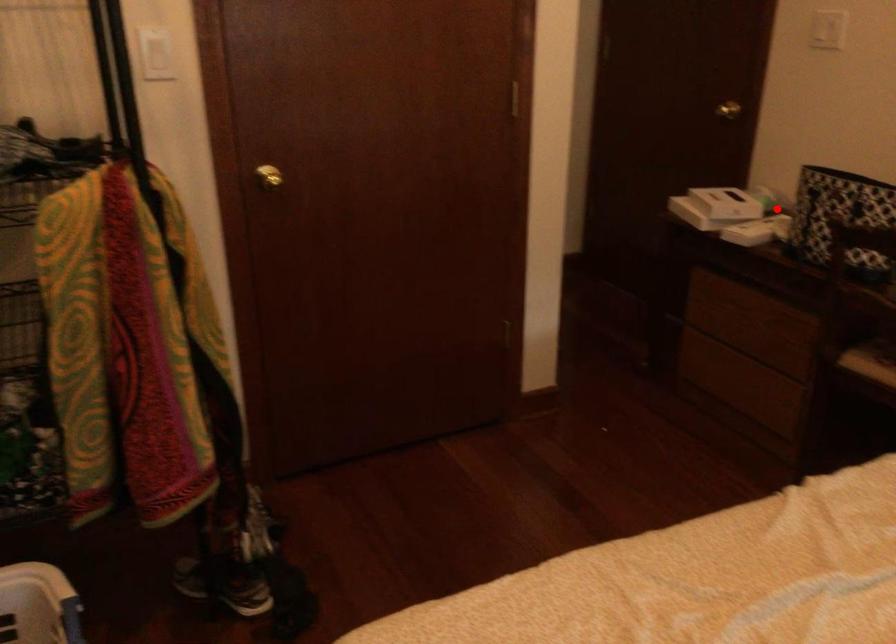
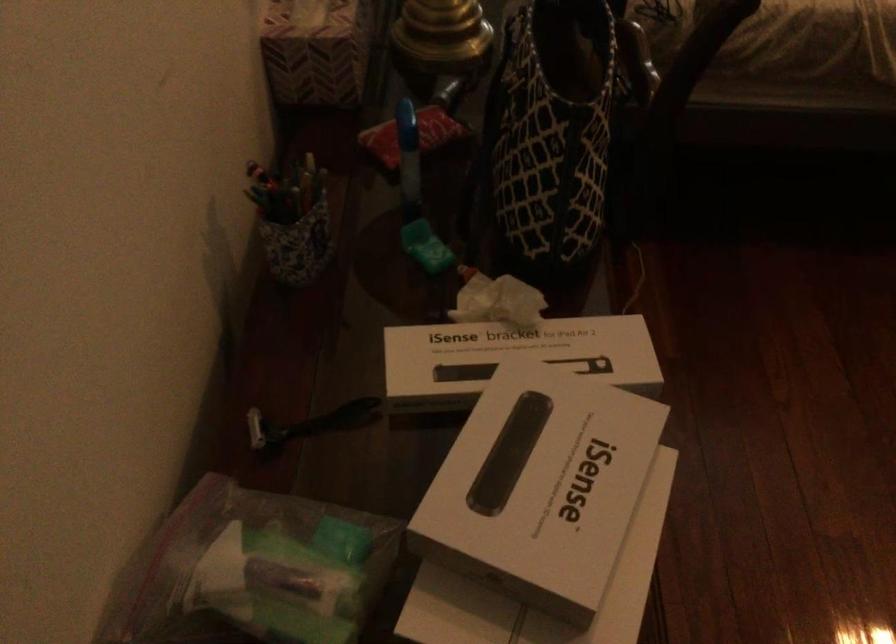
Find the pixel in the second image that matches the highlighted location in the first image.

(309, 422)